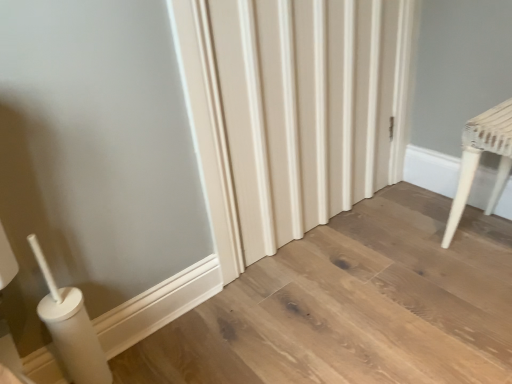
Question: Can you confirm if white woven stool at right is smaller than white textured radiator at center?

Choices:
 (A) yes
 (B) no

Answer: (A)

Question: Does white woven stool at right touch white textured radiator at center?

Choices:
 (A) yes
 (B) no

Answer: (B)

Question: Can you confirm if white woven stool at right is positioned to the right of white textured radiator at center?

Choices:
 (A) yes
 (B) no

Answer: (A)

Question: Does white woven stool at right contain white textured radiator at center?

Choices:
 (A) no
 (B) yes

Answer: (A)

Question: From a real-world perspective, is white woven stool at right below white textured radiator at center?

Choices:
 (A) yes
 (B) no

Answer: (A)

Question: Is white woven stool at right positioned behind white textured radiator at center?

Choices:
 (A) yes
 (B) no

Answer: (A)

Question: Considering the relative sizes of white textured radiator at center and white woven stool at right in the image provided, is white textured radiator at center smaller than white woven stool at right?

Choices:
 (A) no
 (B) yes

Answer: (A)

Question: Is white textured radiator at center aimed at white woven stool at right?

Choices:
 (A) no
 (B) yes

Answer: (B)

Question: Is white textured radiator at center to the right of white woven stool at right from the viewer's perspective?

Choices:
 (A) yes
 (B) no

Answer: (B)

Question: Is white textured radiator at center facing away from white woven stool at right?

Choices:
 (A) yes
 (B) no

Answer: (B)

Question: From a real-world perspective, is white textured radiator at center positioned under white woven stool at right based on gravity?

Choices:
 (A) no
 (B) yes

Answer: (A)

Question: Is the position of white textured radiator at center less distant than that of white woven stool at right?

Choices:
 (A) no
 (B) yes

Answer: (B)

Question: Considering the positions of white textured radiator at center and white woven stool at right in the image, is white textured radiator at center wider or thinner than white woven stool at right?

Choices:
 (A) thin
 (B) wide

Answer: (A)